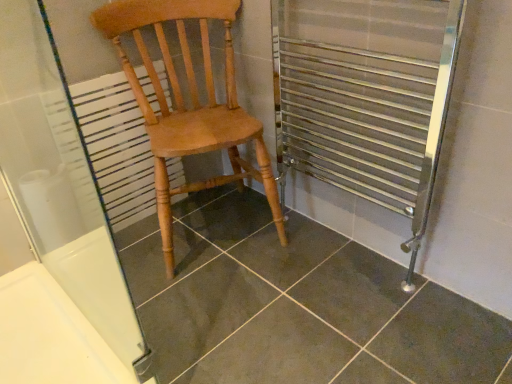
This screenshot has height=384, width=512. Find the location of `free point above white textured radiator at left (from a real-world perspective)`. free point above white textured radiator at left (from a real-world perspective) is located at coordinates (93, 73).